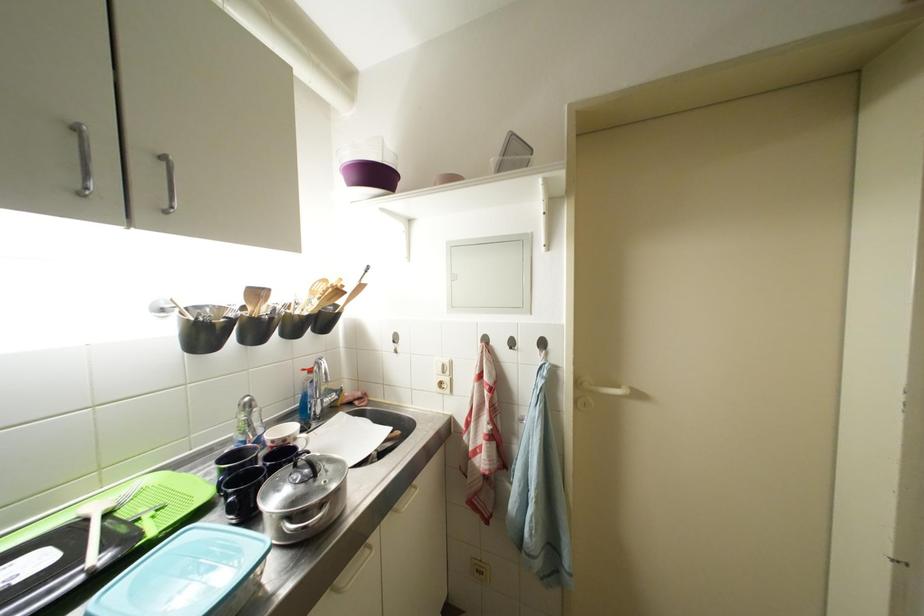
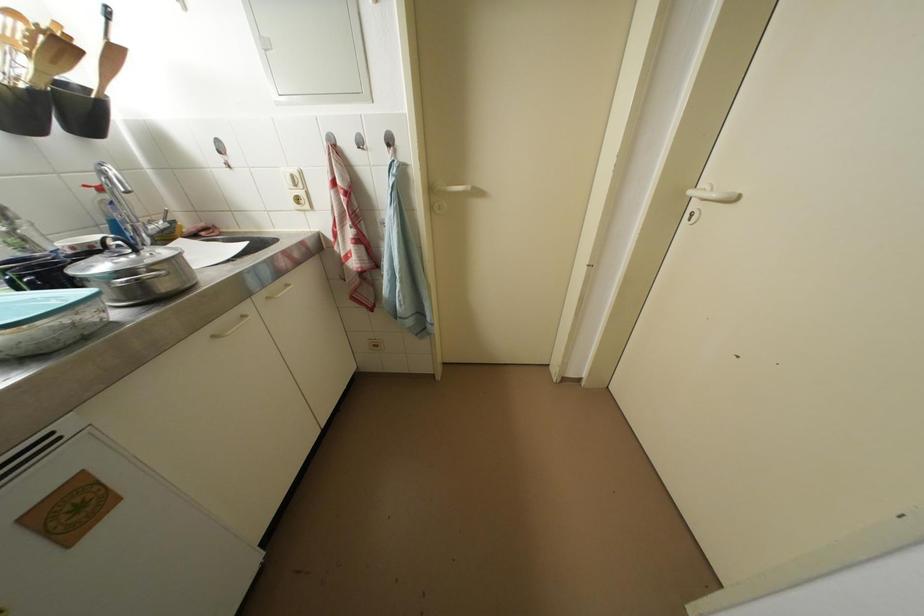
The first image is from the beginning of the video and the second image is from the end. How did the camera likely rotate when shooting the video?

The camera rotated toward right-down.